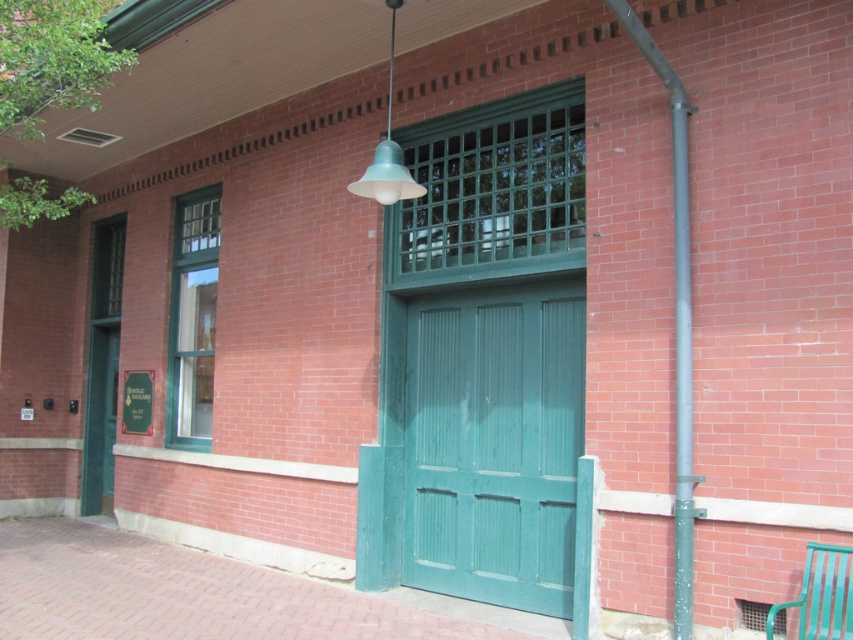
Question: Estimate the real-world distances between objects in this image. Which object is farther from the teal glass lampshade at upper center?

Choices:
 (A) metallic gray pipe at right
 (B) green metal bench at lower right
 (C) teal wooden door at center

Answer: (B)

Question: Which point is farther to the camera?

Choices:
 (A) teal glass lampshade at upper center
 (B) metallic gray pipe at right
 (C) teal wooden door at center

Answer: (C)

Question: Can you confirm if metallic gray pipe at right is positioned below green metal bench at lower right?

Choices:
 (A) no
 (B) yes

Answer: (A)

Question: Based on their relative distances, which object is farther from the teal wooden door at center?

Choices:
 (A) teal glass lampshade at upper center
 (B) metallic gray pipe at right
 (C) green metal bench at lower right

Answer: (C)

Question: Does metallic gray pipe at right have a greater width compared to teal glass lampshade at upper center?

Choices:
 (A) yes
 (B) no

Answer: (A)

Question: Is metallic gray pipe at right to the left of green metal bench at lower right from the viewer's perspective?

Choices:
 (A) no
 (B) yes

Answer: (B)